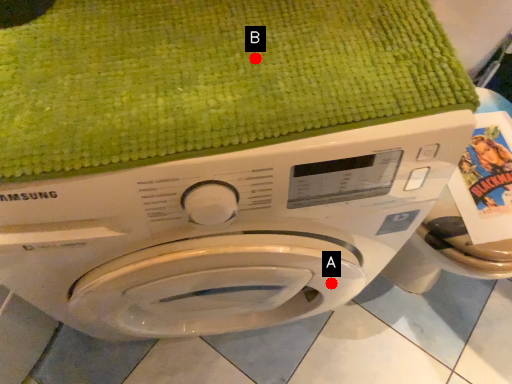
Question: Two points are circled on the image, labeled by A and B beside each circle. Which point is closer to the camera?

Choices:
 (A) A is closer
 (B) B is closer

Answer: (B)